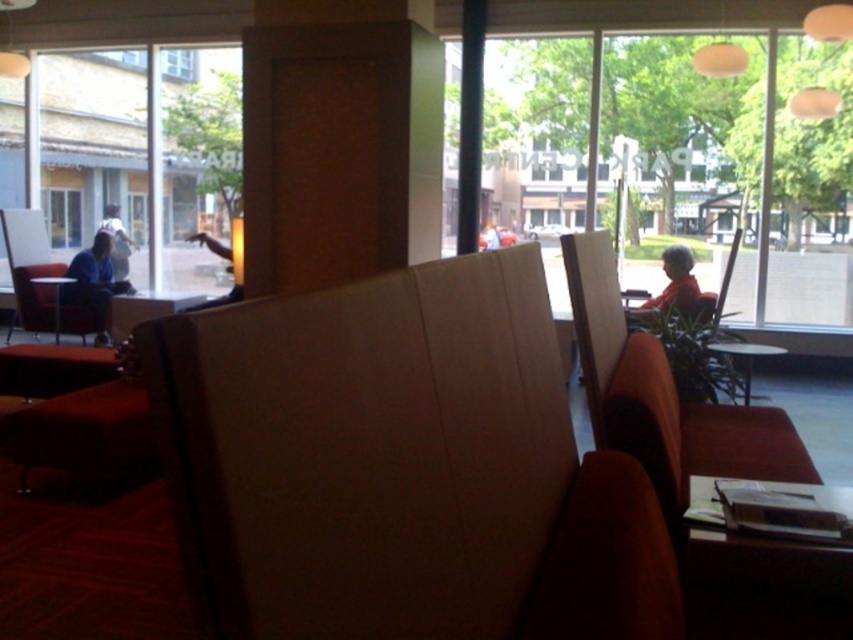
Question: Can you confirm if blue fabric jacket at left is positioned above matte black table at left?

Choices:
 (A) yes
 (B) no

Answer: (A)

Question: Based on their relative distances, which object is farther from the white glossy table at lower right?

Choices:
 (A) wooden table at lower right
 (B) clear glass window at upper center

Answer: (B)

Question: Among these objects, which one is farthest from the camera?

Choices:
 (A) matte red shirt at right
 (B) white cotton shirt at left
 (C) white glossy table at lower right

Answer: (B)

Question: Which of the following is the farthest from the observer?

Choices:
 (A) (668, 298)
 (B) (55, 301)
 (C) (178, 65)

Answer: (C)

Question: Is wooden table at lower right above white cotton shirt at left?

Choices:
 (A) yes
 (B) no

Answer: (B)

Question: Is wooden table at lower right smaller than matte red shirt at right?

Choices:
 (A) yes
 (B) no

Answer: (A)